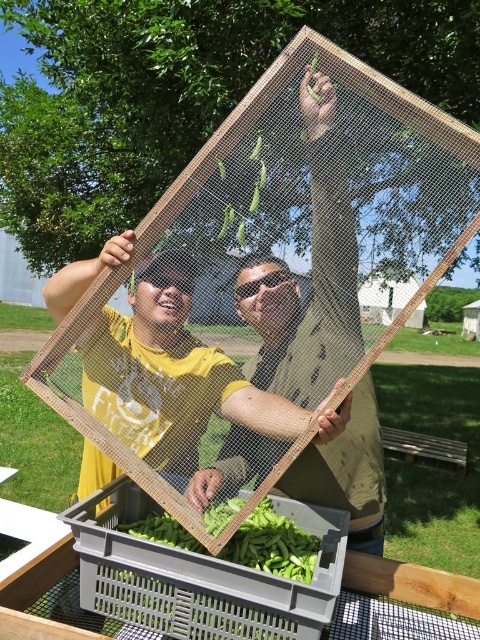
You are a photographer trying to capture a clear photo of the matte yellow shirt at center and the green matte beans at center. Which object should you focus on first if you want to ensure both are in focus without moving the camera?

The matte yellow shirt at center is taller than the green matte beans at center, so focusing on the taller matte yellow shirt at center first would help ensure both are in focus since it is farther away.

From the picture: You are a photographer trying to capture a clear shot of the wooden frame at center and the matte yellow shirt at center. From your current position, which object would appear closer to you in the photo?

The wooden frame at center would appear closer because the matte yellow shirt at center is positioned behind it.